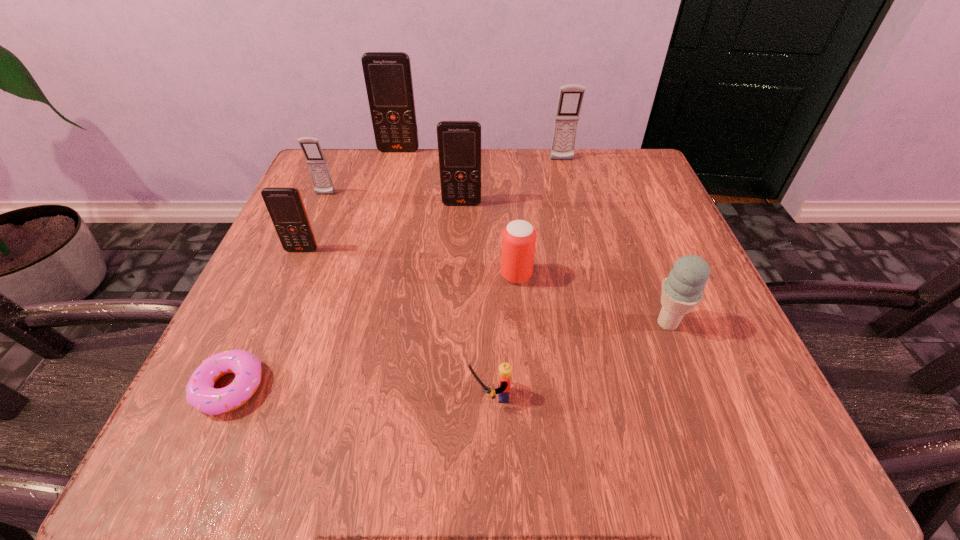
Where is `the rightmost object`? Image resolution: width=960 pixels, height=540 pixels. the rightmost object is located at coordinates (682, 290).

At what (x,y) coordinates should I click in order to perform the action: click on the seventh farthest object. Please return your answer as a coordinate pair (x, y). This screenshot has height=540, width=960. Looking at the image, I should click on (682, 290).

Identify the location of beer can. The width and height of the screenshot is (960, 540). (519, 237).

Locate an element on the screen. This screenshot has width=960, height=540. red beer can is located at coordinates (519, 237).

Where is `yellow Lego`? The width and height of the screenshot is (960, 540). yellow Lego is located at coordinates (505, 369).

At what (x,y) coordinates should I click in order to perform the action: click on the shortest object. Please return your answer as a coordinate pair (x, y). The height and width of the screenshot is (540, 960). Looking at the image, I should click on (200, 393).

The width and height of the screenshot is (960, 540). In order to click on doughnut in this screenshot , I will do `click(200, 393)`.

Image resolution: width=960 pixels, height=540 pixels. Find the location of `vacant area situated 0.400m on the screen of the second orange cellular telephone from right to left`. vacant area situated 0.400m on the screen of the second orange cellular telephone from right to left is located at coordinates (369, 269).

Find the location of a particular element. Image resolution: width=960 pixels, height=540 pixels. vacant position located on the front-facing side of the right gray cellular telephone is located at coordinates (579, 227).

This screenshot has height=540, width=960. I want to click on vacant space situated 0.340m on the screen of the fourth farthest object, so click(455, 341).